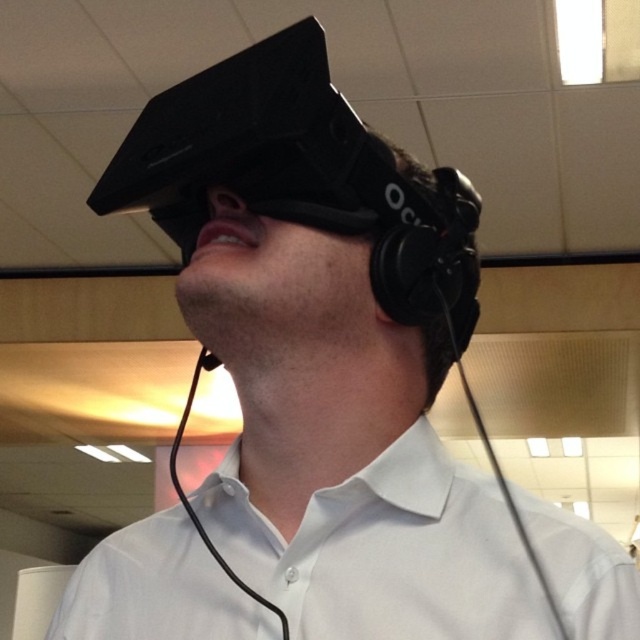
Question: Is white cotton dress shirt at center further to the viewer compared to black matte earphone at upper center?

Choices:
 (A) no
 (B) yes

Answer: (A)

Question: Among these points, which one is nearest to the camera?

Choices:
 (A) (211, 356)
 (B) (96, 637)

Answer: (B)

Question: Is white cotton dress shirt at center wider than black matte earphone at upper center?

Choices:
 (A) yes
 (B) no

Answer: (A)

Question: Does white cotton dress shirt at center have a greater width compared to black matte earphone at upper center?

Choices:
 (A) yes
 (B) no

Answer: (A)

Question: Which of the following is the closest to the observer?

Choices:
 (A) white cotton dress shirt at center
 (B) black matte earphone at upper center

Answer: (A)